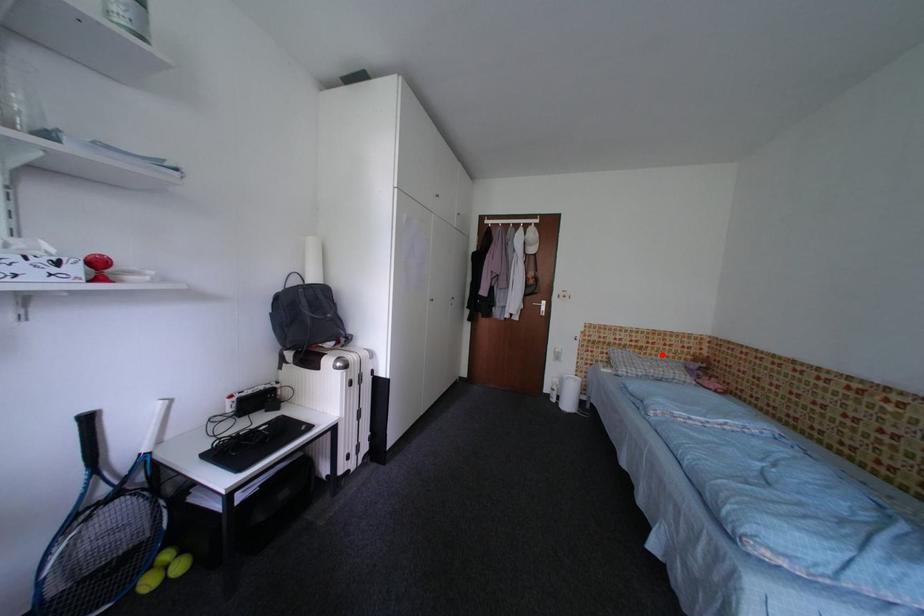
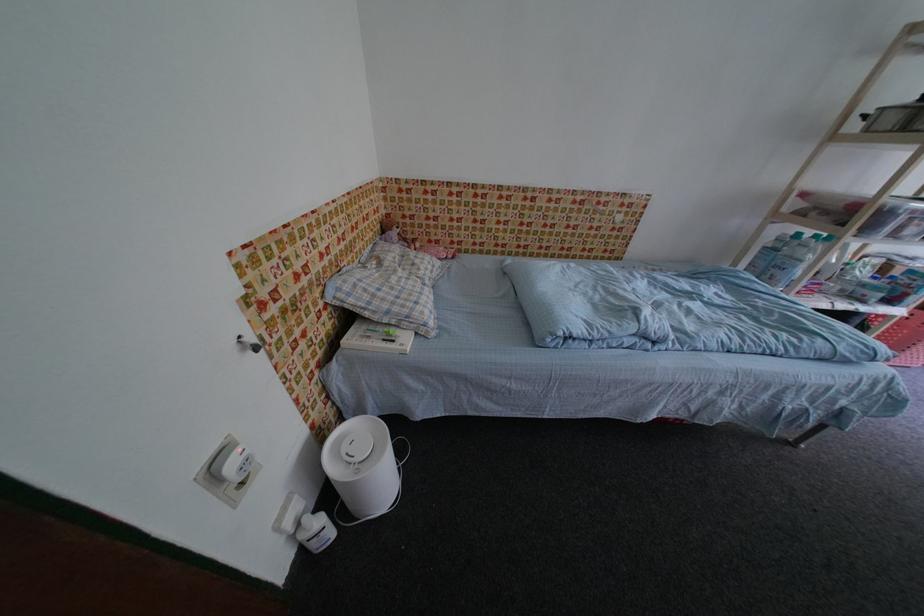
Question: I am providing you with two images of the same scene from different viewpoints. Image1 has a red point marked. In image2, the corresponding 3D location appears at what relative position? Reply with the corresponding letter.

Choices:
 (A) Closer
 (B) Farther

Answer: (A)